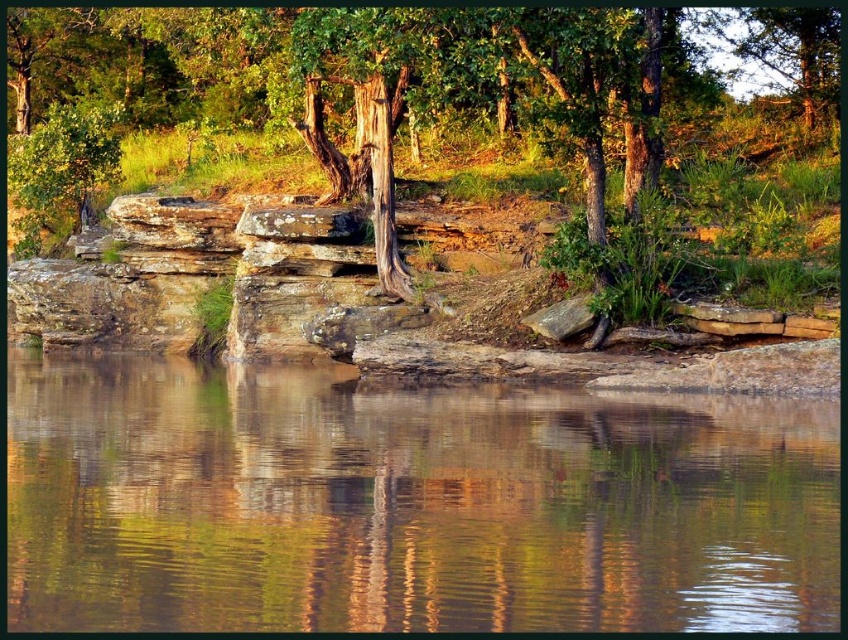
Question: Does green reflective water at center have a greater width compared to smooth bark tree at center?

Choices:
 (A) yes
 (B) no

Answer: (B)

Question: Which point appears closest to the camera in this image?

Choices:
 (A) (516, 513)
 (B) (371, 109)

Answer: (A)

Question: Does green reflective water at center appear on the left side of smooth bark tree at center?

Choices:
 (A) yes
 (B) no

Answer: (B)

Question: From the image, what is the correct spatial relationship of green reflective water at center in relation to smooth bark tree at center?

Choices:
 (A) right
 (B) left

Answer: (A)

Question: Which point is closer to the camera taking this photo?

Choices:
 (A) (350, 74)
 (B) (777, 496)

Answer: (B)